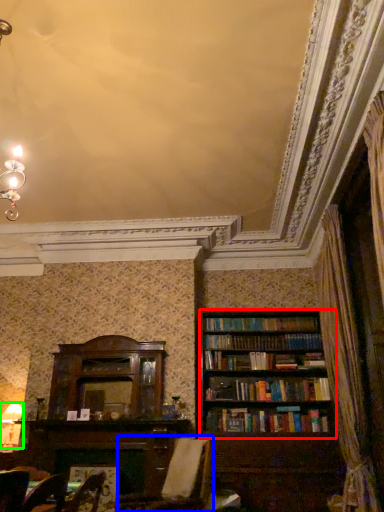
Question: Which object is positioned closest to bookcase (highlighted by a red box)? Select from swivel chair (highlighted by a blue box) and lamp (highlighted by a green box).

Choices:
 (A) swivel chair
 (B) lamp

Answer: (A)